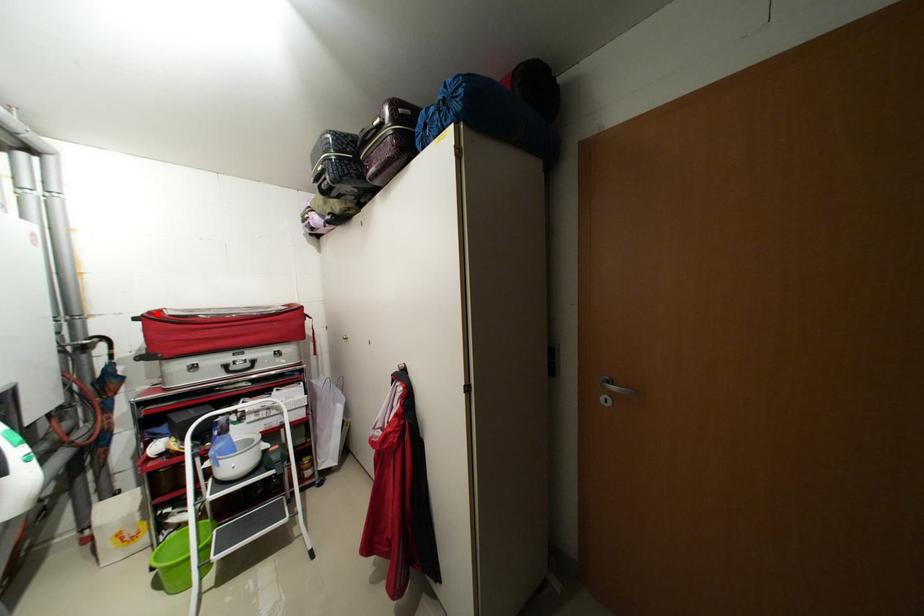
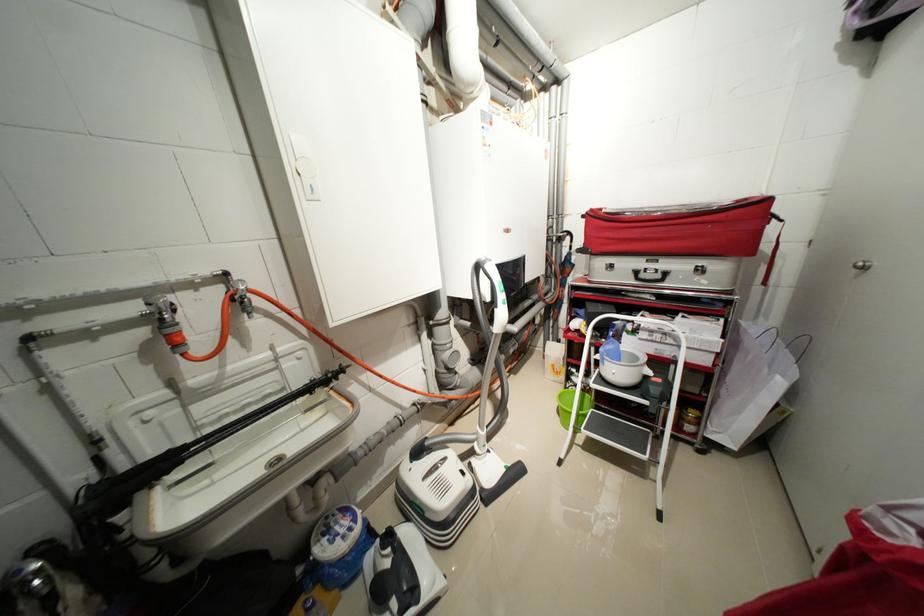
The point at the highlighted location is marked in the first image. Where is the corresponding point in the second image?

(599, 211)